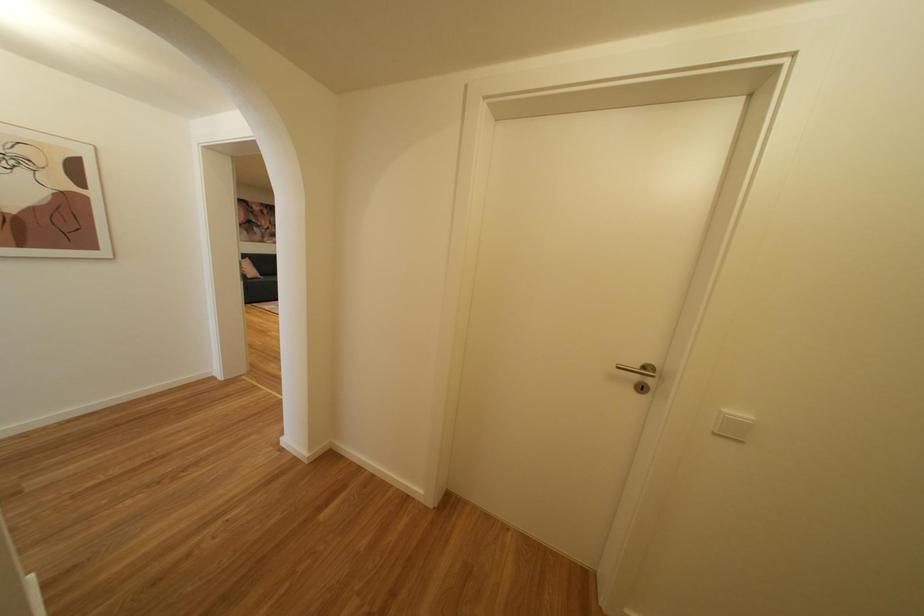
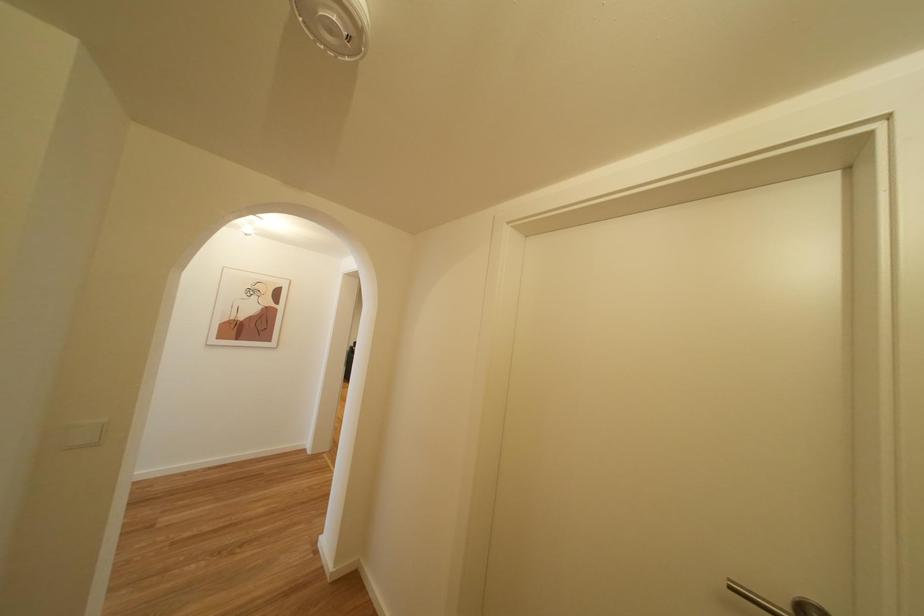
The first image is from the beginning of the video and the second image is from the end. How did the camera likely rotate when shooting the video?

The camera's rotation is toward left-up.